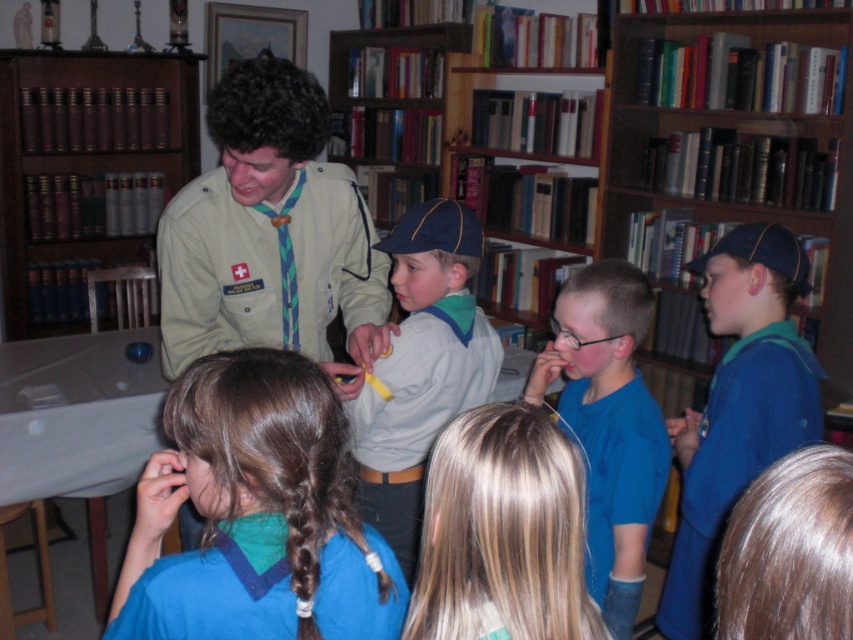
What is located at the coordinates point (254, 515)?

The blue matte uniform at center is located at point (254, 515).

Based on the photo, you are a librarian who needs to place a new book that is 1.2 meters wide on the wooden bookshelf at upper center. Can the book fit on the shelf based on its width compared to the blue fabric uniform at right?

The wooden bookshelf at upper center is wider than the blue fabric uniform at right. Since the uniform is at the right side, the bookshelf has enough width to accommodate the 1.2 meter wide book.

Based on the coordinates provided, which object in the scene is located at the point with coordinates (x=740, y=138)?

The wooden bookshelf at upper center is located at the point with coordinates (x=740, y=138).